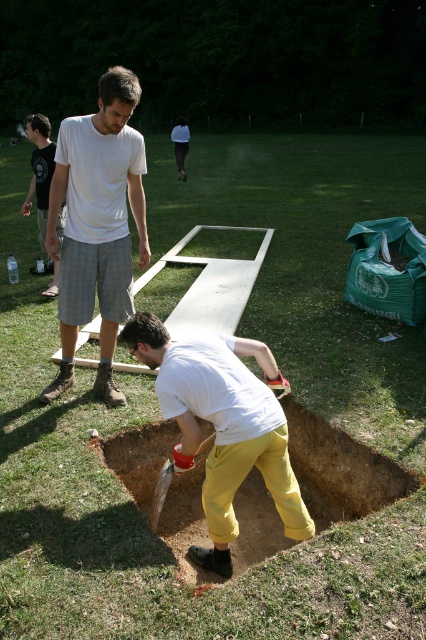
Which is below, yellow cotton pants at lower center or white t-shirt at upper left?

yellow cotton pants at lower center is below.

Between yellow cotton pants at lower center and white t-shirt at upper left, which one is positioned higher?

Positioned higher is white t-shirt at upper left.

Is point (235, 445) closer to camera compared to point (46, 205)?

That is True.

Find the location of a particular element. This screenshot has height=640, width=426. yellow cotton pants at lower center is located at coordinates (222, 426).

Does white cotton shirt at upper left have a larger size compared to white t-shirt at upper left?

Incorrect, white cotton shirt at upper left is not larger than white t-shirt at upper left.

Is point (86, 172) closer to camera compared to point (42, 140)?

Yes.

The image size is (426, 640). What are the coordinates of `white cotton shirt at upper left` in the screenshot? It's located at (97, 225).

At what (x,y) coordinates should I click in order to perform the action: click on white cotton shirt at upper left. Please return your answer as a coordinate pair (x, y). This screenshot has height=640, width=426. Looking at the image, I should click on (97, 225).

Is point (232, 449) farther from viewer compared to point (166, 472)?

No, it is in front of (166, 472).

Which is more to the left, yellow cotton pants at lower center or wooden shovel at lower center?

Positioned to the left is wooden shovel at lower center.

Is point (285, 497) closer to camera compared to point (170, 477)?

Yes, point (285, 497) is in front of point (170, 477).

I want to click on yellow cotton pants at lower center, so click(x=222, y=426).